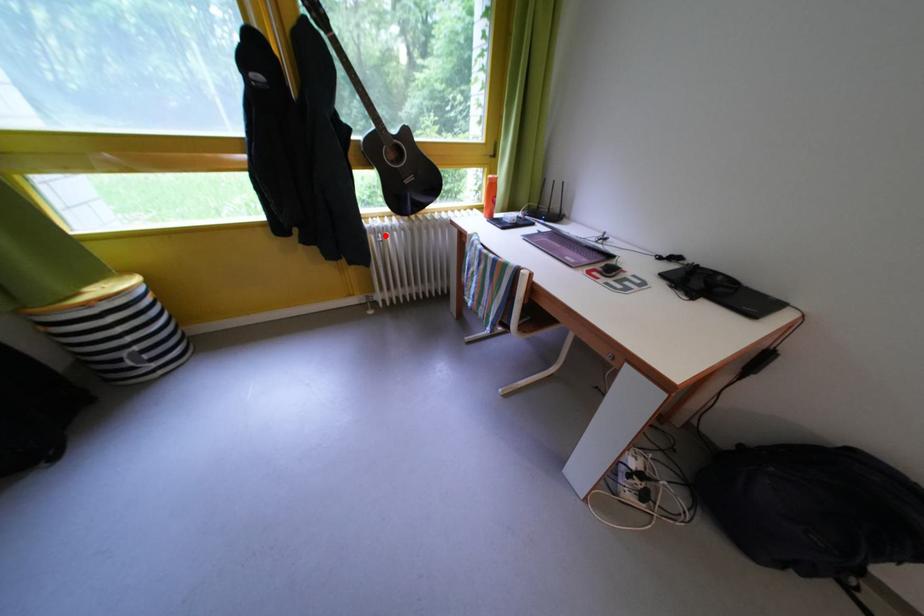
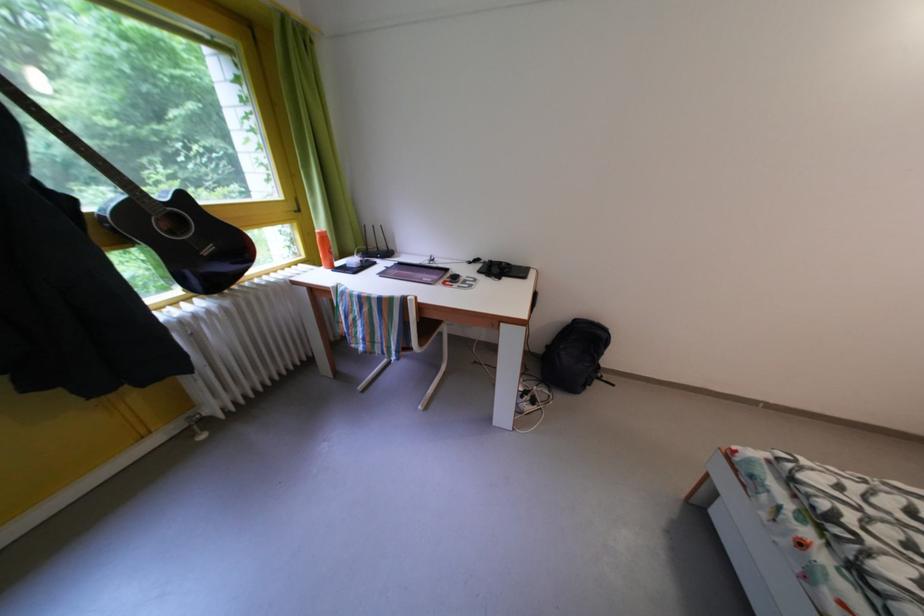
Question: I am providing you with two images of the same scene from different viewpoints. A red point is marked on the first image. Can you still see the location of the red point in image 2?

Choices:
 (A) Yes
 (B) No

Answer: (A)